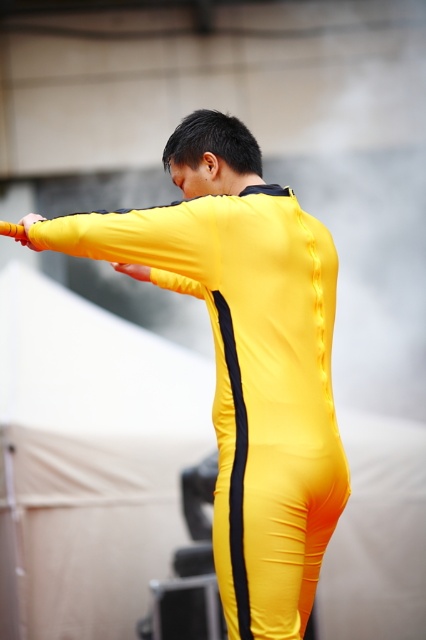
Is yellow matte arm at center to the right of yellow matte baton at upper left from the viewer's perspective?

Indeed, yellow matte arm at center is positioned on the right side of yellow matte baton at upper left.

Which is in front, point (157, 208) or point (32, 250)?

Point (157, 208) is in front.

Identify the location of yellow matte arm at center. (143, 241).

Between yellow matte arm at center and matte yellow glove at upper center, which one is positioned higher?

Positioned higher is yellow matte arm at center.

Can you confirm if yellow matte arm at center is positioned to the left of matte yellow glove at upper center?

In fact, yellow matte arm at center is to the right of matte yellow glove at upper center.

Does point (146, 228) lie in front of point (135, 276)?

Yes, point (146, 228) is in front of point (135, 276).

You are a GUI agent. You are given a task and a screenshot of the screen. Output one action in this format:
    pyautogui.click(x=<x>, y=<y>)
    Task: Click on the yellow matte arm at center
    
    Given the screenshot: What is the action you would take?
    pyautogui.click(x=143, y=241)

Which is more to the left, yellow matte/satin jumpsuit at center or yellow matte baton at upper left?

yellow matte baton at upper left

Can you confirm if yellow matte/satin jumpsuit at center is positioned below yellow matte baton at upper left?

Yes.

What do you see at coordinates (245, 356) in the screenshot?
I see `yellow matte/satin jumpsuit at center` at bounding box center [245, 356].

The height and width of the screenshot is (640, 426). I want to click on yellow matte/satin jumpsuit at center, so pos(245,356).